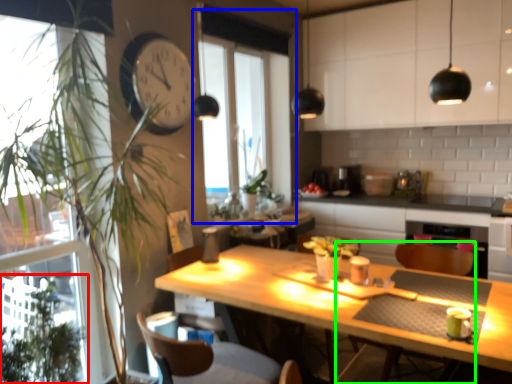
Question: Estimate the real-world distances between objects in this image. Which object is farther from plant (highlighted by a red box), window (highlighted by a blue box) or armchair (highlighted by a green box)?

Choices:
 (A) window
 (B) armchair

Answer: (A)